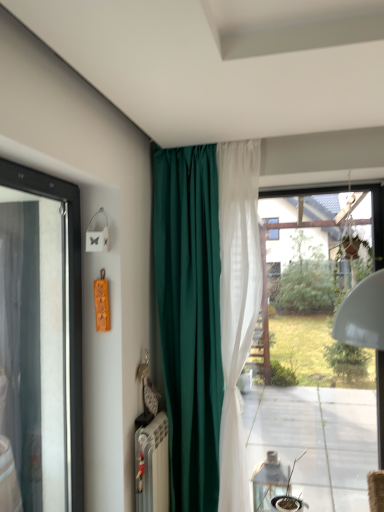
The image size is (384, 512). What are the coordinates of `green satin curtain at center` in the screenshot? It's located at (206, 313).

Describe the element at coordinates (206, 313) in the screenshot. I see `green satin curtain at center` at that location.

Measure the distance between point [222,252] and camera.

A distance of 7.81 feet exists between point [222,252] and camera.

In order to click on green satin curtain at center in this screenshot , I will do `click(206, 313)`.